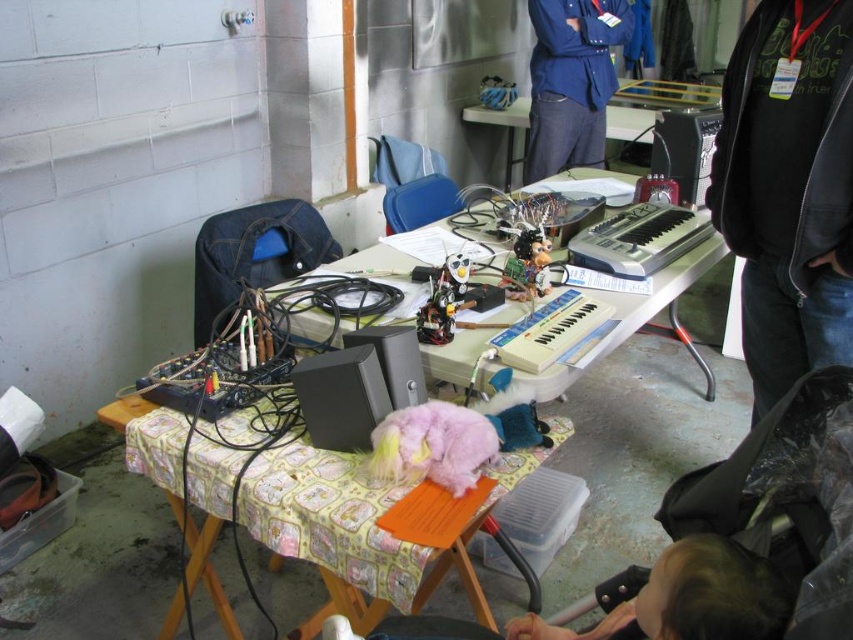
You are a delivery person who needs to place a large package on the white plastic table at center. You are currently standing next to the light brown hair at lower center. Can you reach the table without moving your feet?

The distance between the light brown hair at lower center and the white plastic table at center is 2.77 meters. Since the average person can reach about 1.5 meters without moving, you cannot reach the table without moving your feet.

You are organizing the cluttered workspace and need to place the fuzzy pink plushie at center and the silver metallic keyboard at center into storage boxes. If the keyboard box can only fit items smaller than the plushie, will both items fit in the same box?

The fuzzy pink plushie at center is larger than the silver metallic keyboard at center, so the keyboard can fit in the box, but the plushie cannot. Therefore, they cannot both fit in the same box.

You are organizing the cluttered workspace and need to place the fuzzy pink plushie at center and the silver metallic keyboard at center side by side on the table. Which object should be placed first to ensure they both fit without overlapping?

The fuzzy pink plushie at center should be placed first because it is wider than the silver metallic keyboard at center, so positioning it first ensures there is enough space for both objects on the table.